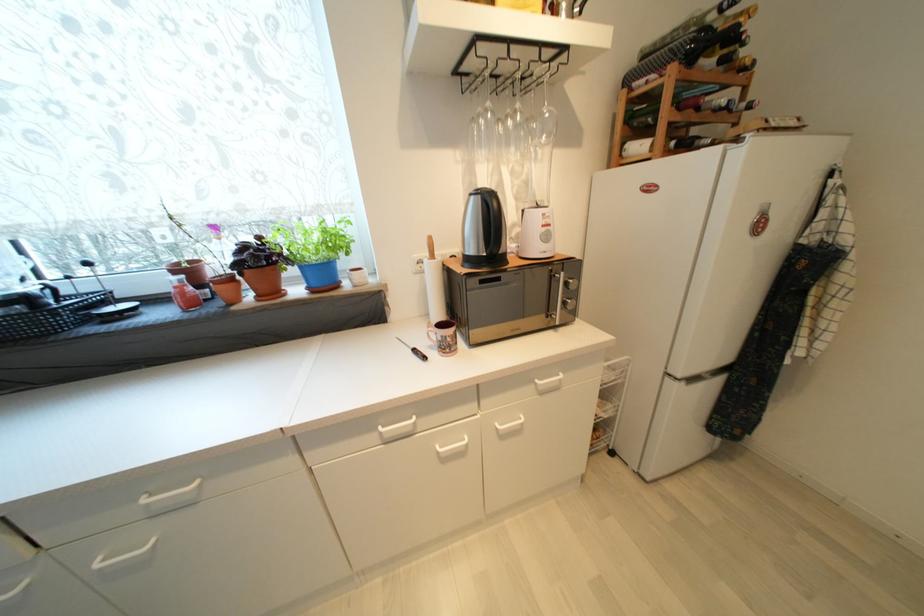
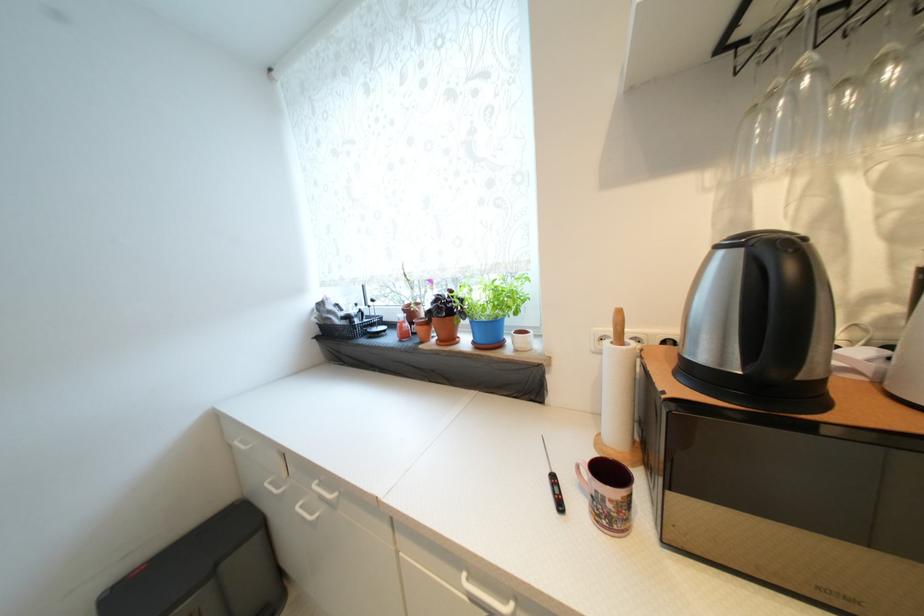
In the second image, find the point that corresponds to the point at 264,299 in the first image.

(445, 342)